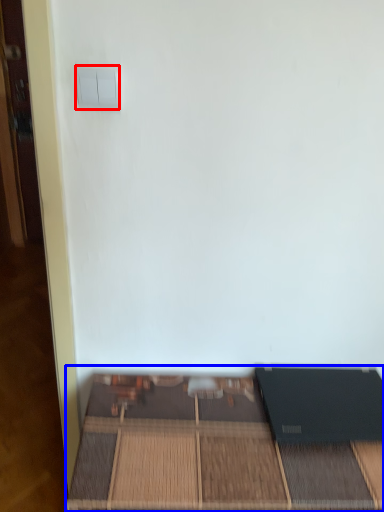
Question: Which object is closer to the camera taking this photo, light switch (highlighted by a red box) or furniture (highlighted by a blue box)?

Choices:
 (A) light switch
 (B) furniture

Answer: (A)